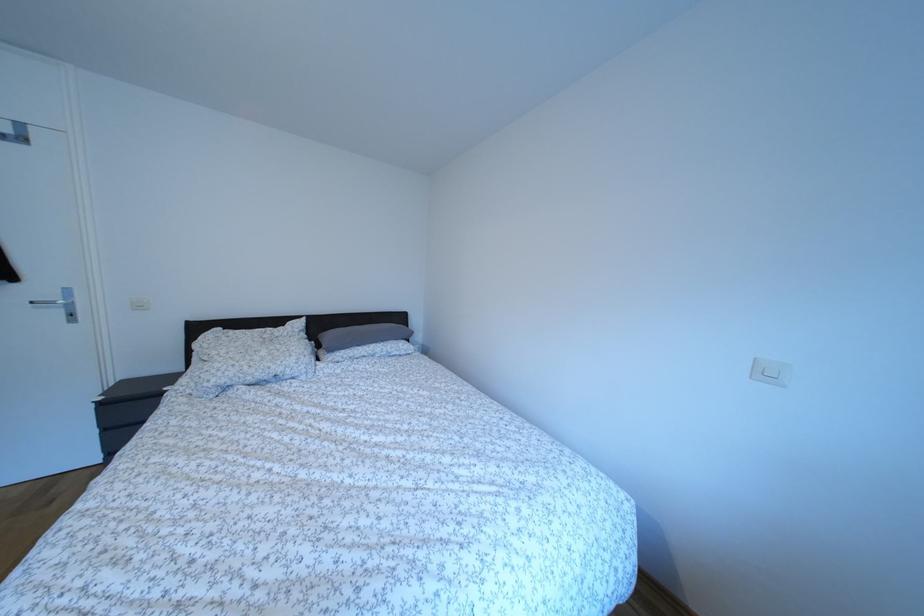
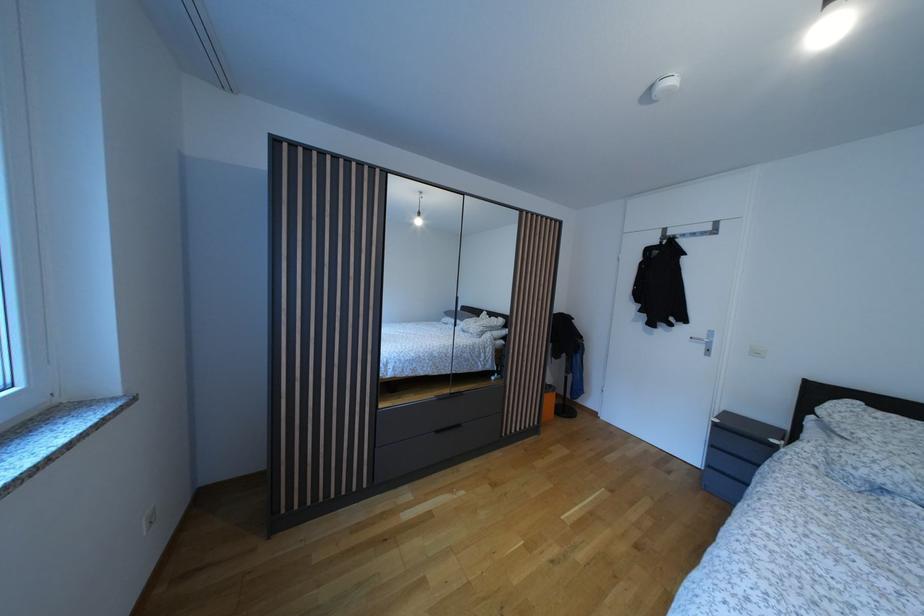
Question: The camera is either moving clockwise (left) or counter-clockwise (right) around the object. The first image is from the beginning of the video and the second image is from the end. Is the camera moving left or right when shooting the video?

Choices:
 (A) Left
 (B) Right

Answer: (B)